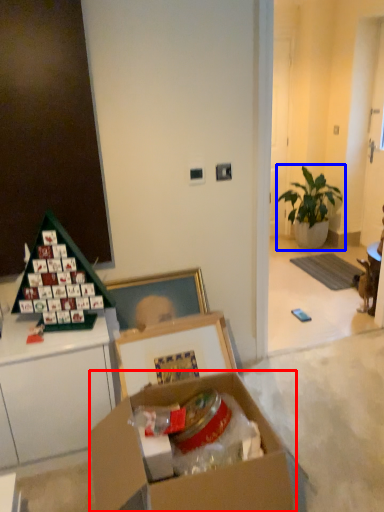
Question: Which point is closer to the camera, box (highlighted by a red box) or houseplant (highlighted by a blue box)?

Choices:
 (A) box
 (B) houseplant

Answer: (A)